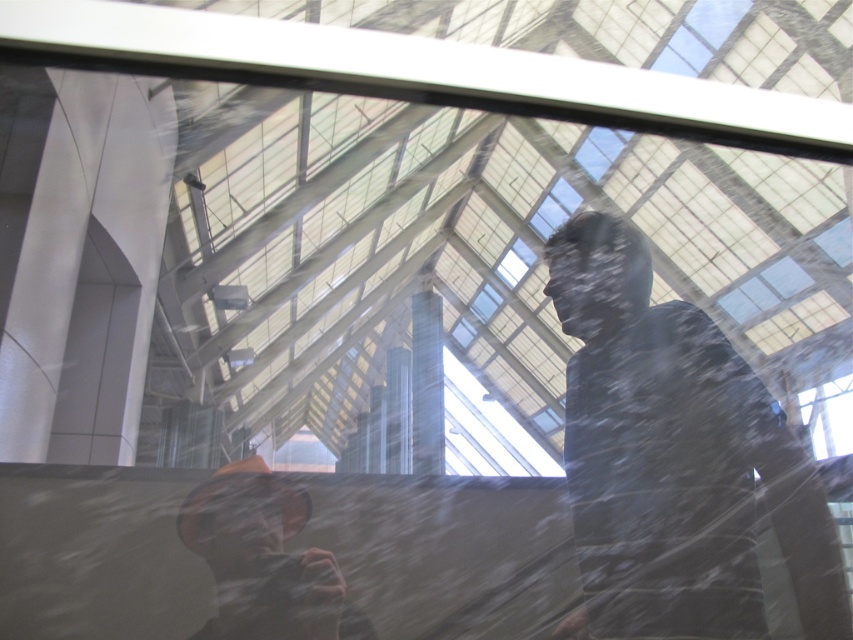
Question: Estimate the real-world distances between objects in this image. Which object is farther from the matte black jacket at right?

Choices:
 (A) orange fabric hat at lower left
 (B) transparent glass window at upper center

Answer: (B)

Question: Estimate the real-world distances between objects in this image. Which object is farther from the orange fabric hat at lower left?

Choices:
 (A) matte black jacket at right
 (B) transparent glass window at upper center

Answer: (B)

Question: Can you confirm if orange fabric hat at lower left is positioned to the right of transparent glass window at upper center?

Choices:
 (A) no
 (B) yes

Answer: (A)

Question: Among these objects, which one is nearest to the camera?

Choices:
 (A) matte black jacket at right
 (B) orange fabric hat at lower left
 (C) transparent glass window at upper center

Answer: (A)

Question: Is matte black jacket at right above orange fabric hat at lower left?

Choices:
 (A) yes
 (B) no

Answer: (A)

Question: Where is matte black jacket at right located in relation to orange fabric hat at lower left in the image?

Choices:
 (A) above
 (B) below

Answer: (A)